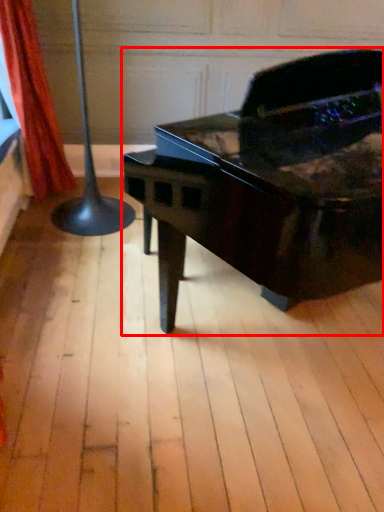
Question: In this image, where is piano (annotated by the red box) located relative to curtain?

Choices:
 (A) right
 (B) left

Answer: (A)